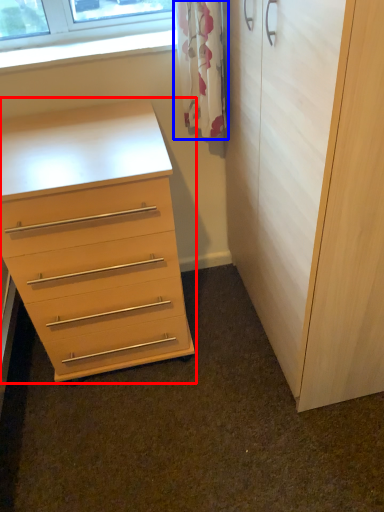
Question: Which object appears closest to the camera in this image, chest of drawers (highlighted by a red box) or curtain (highlighted by a blue box)?

Choices:
 (A) chest of drawers
 (B) curtain

Answer: (A)